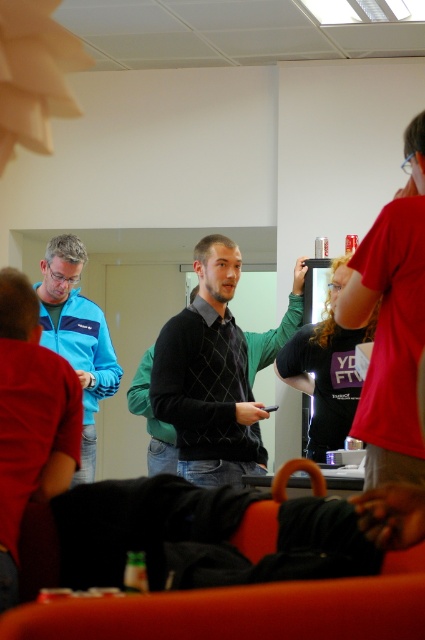
You are standing in the room and want to hand a document to both the person wearing the matte black sweater at center and the person wearing the blue fabric jacket at left. Which person should you approach first if you want to reach the one closer to the entrance?

The blue fabric jacket at left is closer to the entrance than the matte black sweater at center, so you should approach the person wearing the blue fabric jacket at left first.

You are standing in the room and want to hand a document to both the person wearing the dark gray sweater at center and the person wearing the blue fabric jacket at left. Which person should you approach first if you want to reach the one closer to the entrance?

The blue fabric jacket at left is closer to the entrance than the dark gray sweater at center, so you should approach the person wearing the blue fabric jacket at left first.

You are standing in the room and want to greet the person wearing the dark gray sweater at center without walking behind the matte black sweater at center. Is this possible?

The matte black sweater at center is in front of the dark gray sweater at center, so you cannot see or reach the dark gray sweater at center without moving around the matte black sweater at center.